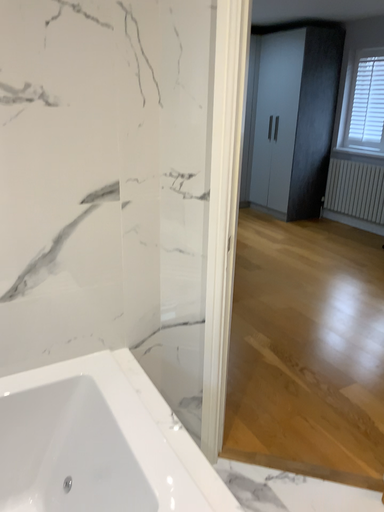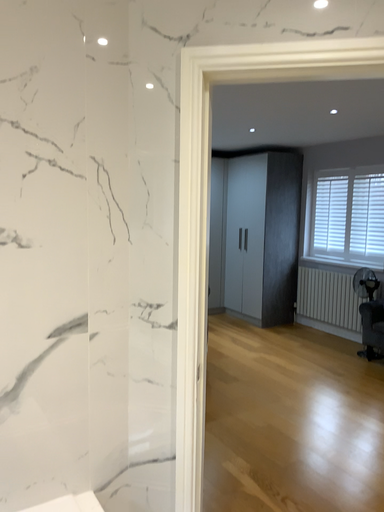
Question: How did the camera likely rotate when shooting the video?

Choices:
 (A) rotated downward
 (B) rotated upward

Answer: (B)